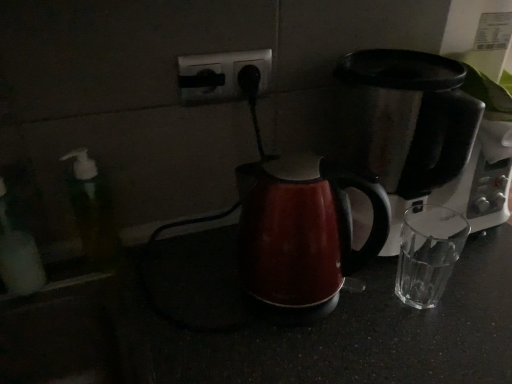
Question: Does translucent plastic soap dispenser at left contain black plastic outlet at center?

Choices:
 (A) yes
 (B) no

Answer: (B)

Question: Could you tell me if translucent plastic soap dispenser at left is turned towards black plastic outlet at center?

Choices:
 (A) yes
 (B) no

Answer: (B)

Question: From a real-world perspective, is translucent plastic soap dispenser at left over black plastic outlet at center?

Choices:
 (A) yes
 (B) no

Answer: (B)

Question: Is translucent plastic soap dispenser at left to the right of black plastic outlet at center from the viewer's perspective?

Choices:
 (A) no
 (B) yes

Answer: (A)

Question: Does translucent plastic soap dispenser at left come behind black plastic outlet at center?

Choices:
 (A) yes
 (B) no

Answer: (B)

Question: Does translucent plastic soap dispenser at left have a lesser height compared to black plastic outlet at center?

Choices:
 (A) no
 (B) yes

Answer: (A)

Question: Is glossy plastic kettle at center turned away from black plastic outlet at center?

Choices:
 (A) yes
 (B) no

Answer: (A)

Question: Considering the relative sizes of glossy plastic kettle at center and black plastic outlet at center in the image provided, is glossy plastic kettle at center bigger than black plastic outlet at center?

Choices:
 (A) yes
 (B) no

Answer: (A)

Question: Does glossy plastic kettle at center appear on the left side of black plastic outlet at center?

Choices:
 (A) no
 (B) yes

Answer: (A)

Question: Is glossy plastic kettle at center next to black plastic outlet at center?

Choices:
 (A) no
 (B) yes

Answer: (A)

Question: Is glossy plastic kettle at center completely or partially outside of black plastic outlet at center?

Choices:
 (A) yes
 (B) no

Answer: (A)

Question: Is glossy plastic kettle at center taller than black plastic outlet at center?

Choices:
 (A) no
 (B) yes

Answer: (B)

Question: From the image's perspective, is black plastic outlet at center beneath translucent plastic soap dispenser at left?

Choices:
 (A) yes
 (B) no

Answer: (B)